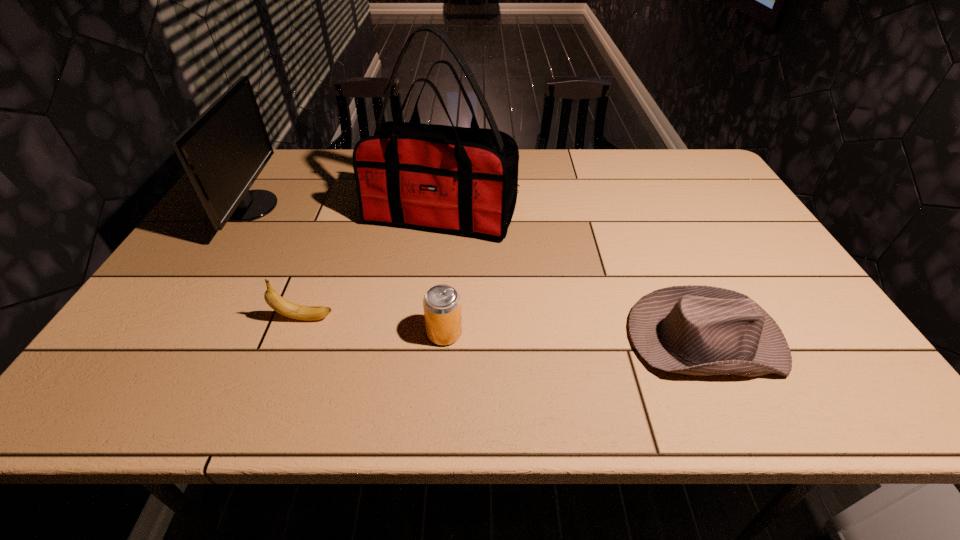
In order to click on the tallest object in this screenshot , I will do `click(461, 180)`.

The height and width of the screenshot is (540, 960). I want to click on the leftmost object, so click(x=224, y=150).

Where is `the second tallest object`? the second tallest object is located at coordinates (224, 150).

Where is `banana`? Image resolution: width=960 pixels, height=540 pixels. banana is located at coordinates (300, 312).

Where is `pop (soda)`? This screenshot has width=960, height=540. pop (soda) is located at coordinates (442, 303).

This screenshot has height=540, width=960. I want to click on the rightmost object, so click(702, 330).

Find the location of a particular element. free region located on the left of the duffel bag is located at coordinates (267, 215).

Find the location of a particular element. free space located 0.390m on the screen side of the leftmost object is located at coordinates (406, 207).

Find the location of `vacant region located at the start of the peel on the banana`. vacant region located at the start of the peel on the banana is located at coordinates (444, 318).

Identify the location of vacant area located on the right of the pop (soda). (611, 333).